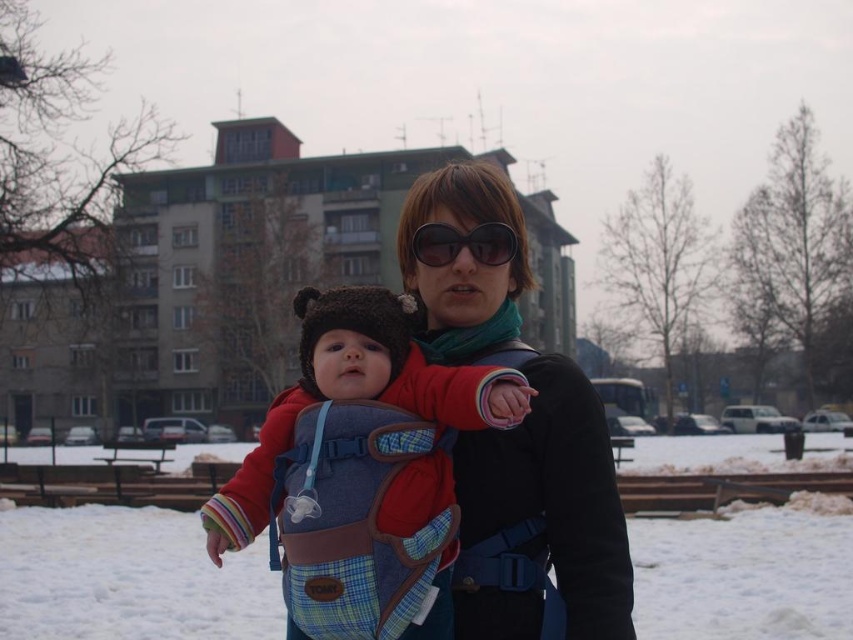
Question: Can you confirm if plaid fabric baby carrier at center is positioned above matte black jacket at center?

Choices:
 (A) yes
 (B) no

Answer: (B)

Question: Can you confirm if matte black jacket at center is bigger than black plastic sunglasses at center?

Choices:
 (A) yes
 (B) no

Answer: (A)

Question: Which is nearer to the matte black jacket at center?

Choices:
 (A) plaid fabric baby carrier at center
 (B) white fluffy snow at center

Answer: (A)

Question: Which point is closer to the camera taking this photo?

Choices:
 (A) (445, 244)
 (B) (508, 381)
 (C) (814, 604)
 (D) (527, 468)

Answer: (B)

Question: Estimate the real-world distances between objects in this image. Which object is farther from the plaid fabric baby carrier at center?

Choices:
 (A) matte black jacket at center
 (B) black plastic sunglasses at center

Answer: (B)

Question: Can you confirm if white fluffy snow at center is positioned to the left of plaid fabric baby carrier at center?

Choices:
 (A) yes
 (B) no

Answer: (A)